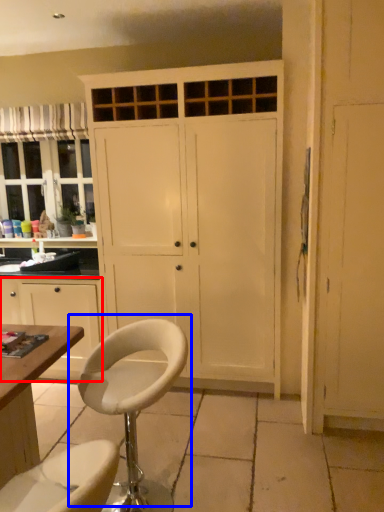
Question: Which object is further to the camera taking this photo, cabinetry (highlighted by a red box) or chair (highlighted by a blue box)?

Choices:
 (A) cabinetry
 (B) chair

Answer: (A)